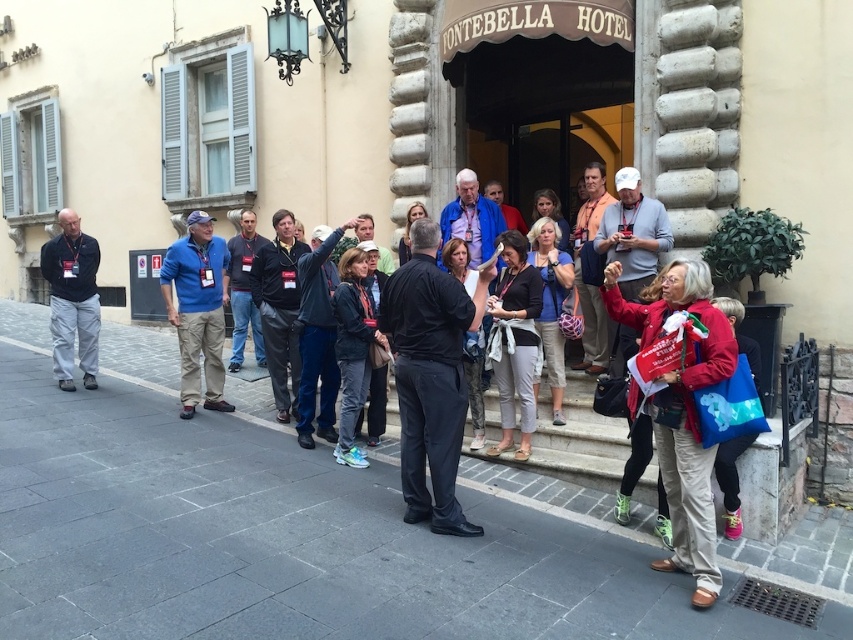
You are standing at the entrance of the Pontebella Hotel and want to place a small statue on the gray stone pavement at center so that it is level with the red fabric bag at lower right. What adjustment should you make to the statue?

Since the gray stone pavement at center has a lesser height compared to the red fabric bag at lower right, you should place the statue on a small platform or raise it slightly to match the height of the red fabric bag at lower right.

You are a photographer standing at the entrance of the Pontebella Hotel. You need to capture a group photo of the people wearing dark gray fabric pants at center and dark blue jacket at center. Since the camera frame can only accommodate one of them, which one should you focus on to ensure they fit within the frame?

The dark blue jacket at center has a greater width than the dark gray fabric pants at center. Therefore, focusing on the dark blue jacket at center ensures it fits within the frame.

Consider the image. You are planning to place a decorative flag on the gray stone pavement at center. However, you also need to ensure there is enough space for the black leather jacket at center. Based on their sizes, can the flag be placed without overlapping the jacket?

The gray stone pavement at center has a smaller size compared to black leather jacket at center, so placing the flag on the gray stone pavement at center may cause overlap with the larger black leather jacket at center. Ensure there is sufficient space between them.